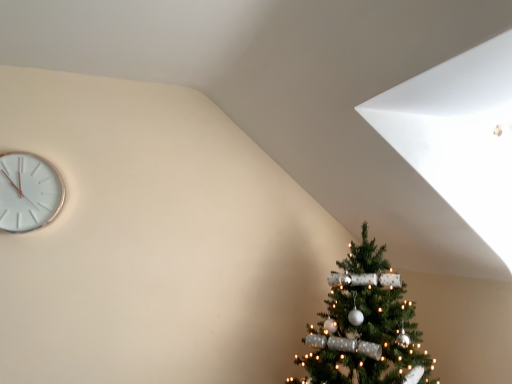
I want to click on green textured christmas tree at lower right, so click(x=365, y=326).

Describe the element at coordinates (365, 326) in the screenshot. I see `green textured christmas tree at lower right` at that location.

This screenshot has height=384, width=512. What are the coordinates of `white metallic clock at upper left` in the screenshot? It's located at (28, 192).

Describe the element at coordinates (28, 192) in the screenshot. I see `white metallic clock at upper left` at that location.

Find the location of a particular element. This screenshot has height=384, width=512. green textured christmas tree at lower right is located at coordinates (365, 326).

Is green textured christmas tree at lower right to the left of white metallic clock at upper left from the viewer's perspective?

No, green textured christmas tree at lower right is not to the left of white metallic clock at upper left.

Which object is further away from the camera, green textured christmas tree at lower right or white metallic clock at upper left?

white metallic clock at upper left is behind.

Considering the positions of points (372, 324) and (56, 182), is point (372, 324) closer to camera compared to point (56, 182)?

Yes, it is in front of point (56, 182).

From the image's perspective, between green textured christmas tree at lower right and white metallic clock at upper left, who is located below?

From the image's view, green textured christmas tree at lower right is below.

From a real-world perspective, is green textured christmas tree at lower right physically located above or below white metallic clock at upper left?

From a real-world perspective, green textured christmas tree at lower right is physically below white metallic clock at upper left.

Is green textured christmas tree at lower right thinner than white metallic clock at upper left?

Incorrect, the width of green textured christmas tree at lower right is not less than that of white metallic clock at upper left.

Considering the sizes of objects green textured christmas tree at lower right and white metallic clock at upper left in the image provided, who is shorter, green textured christmas tree at lower right or white metallic clock at upper left?

white metallic clock at upper left.

Can you confirm if green textured christmas tree at lower right is smaller than white metallic clock at upper left?

Incorrect, green textured christmas tree at lower right is not smaller in size than white metallic clock at upper left.

Is white metallic clock at upper left a part of green textured christmas tree at lower right?

No, white metallic clock at upper left is not surrounded by green textured christmas tree at lower right.

Is green textured christmas tree at lower right not close to white metallic clock at upper left?

Yes, green textured christmas tree at lower right is far from white metallic clock at upper left.

Is green textured christmas tree at lower right oriented towards white metallic clock at upper left?

No.

What's the angular difference between green textured christmas tree at lower right and white metallic clock at upper left's facing directions?

1.2 degrees.

Find the location of `christmas tree lying in front of the white metallic clock at upper left`. christmas tree lying in front of the white metallic clock at upper left is located at coordinates (365, 326).

Between white metallic clock at upper left and green textured christmas tree at lower right, which one appears on the right side from the viewer's perspective?

Positioned to the right is green textured christmas tree at lower right.

Does white metallic clock at upper left lie in front of green textured christmas tree at lower right?

No, white metallic clock at upper left is behind green textured christmas tree at lower right.

Is point (12, 219) in front of point (393, 335)?

No, (12, 219) is behind (393, 335).

Based on the photo, from the image's perspective, relative to green textured christmas tree at lower right, is white metallic clock at upper left above or below?

Clearly, from the image's perspective, white metallic clock at upper left is above green textured christmas tree at lower right.

Consider the image. From a real-world perspective, which object rests below the other?

In real-world perspective, green textured christmas tree at lower right is lower.

Looking at their sizes, would you say white metallic clock at upper left is wider or thinner than green textured christmas tree at lower right?

white metallic clock at upper left is thinner than green textured christmas tree at lower right.

Between white metallic clock at upper left and green textured christmas tree at lower right, which one has less height?

Standing shorter between the two is white metallic clock at upper left.

Considering the sizes of white metallic clock at upper left and green textured christmas tree at lower right in the image, is white metallic clock at upper left bigger or smaller than green textured christmas tree at lower right?

Considering their sizes, white metallic clock at upper left takes up less space than green textured christmas tree at lower right.

Consider the image. Is green textured christmas tree at lower right a part of white metallic clock at upper left?

Definitely not — green textured christmas tree at lower right is not inside white metallic clock at upper left.

Are white metallic clock at upper left and green textured christmas tree at lower right making contact?

They are not placed beside each other.

Is white metallic clock at upper left looking in the opposite direction of green textured christmas tree at lower right?

No, white metallic clock at upper left is not facing the opposite direction of green textured christmas tree at lower right.

I want to click on wall clock on the left side of green textured christmas tree at lower right, so click(x=28, y=192).

Where is `christmas tree located on the right of white metallic clock at upper left`? The height and width of the screenshot is (384, 512). christmas tree located on the right of white metallic clock at upper left is located at coordinates (365, 326).

I want to click on christmas tree beneath the white metallic clock at upper left (from a real-world perspective), so click(365, 326).